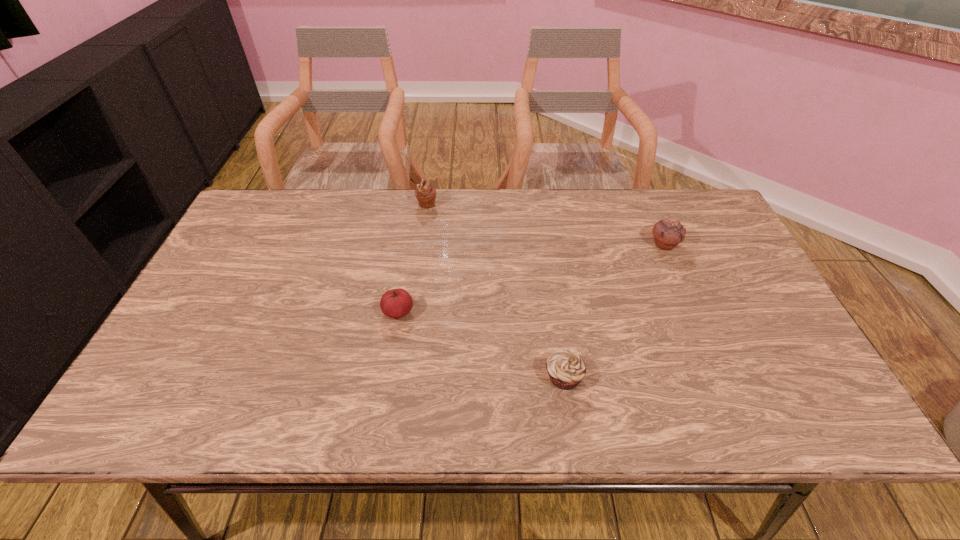
Locate which object is the closest to the third farthest object. Please provide its 2D coordinates. Your answer should be formatted as a tuple, i.e. [(x, y)], where the tuple contains the x and y coordinates of a point satisfying the conditions above.

[(566, 369)]

This screenshot has height=540, width=960. In order to click on object that is the closest to the tallest muffin in this screenshot , I will do tap(396, 303).

You are a GUI agent. You are given a task and a screenshot of the screen. Output one action in this format:
    pyautogui.click(x=<x>, y=<y>)
    Task: Click on the muffin that is the closest to the rightmost muffin
    The width and height of the screenshot is (960, 540).
    Given the screenshot: What is the action you would take?
    pyautogui.click(x=566, y=369)

Locate which muffin is the second closest to the second object from right to left. Please provide its 2D coordinates. Your answer should be formatted as a tuple, i.e. [(x, y)], where the tuple contains the x and y coordinates of a point satisfying the conditions above.

[(425, 193)]

The width and height of the screenshot is (960, 540). Identify the location of vacant area that satisfies the following two spatial constraints: 1. on the back side of the rightmost object; 2. on the right side of the tomato. coord(410,244).